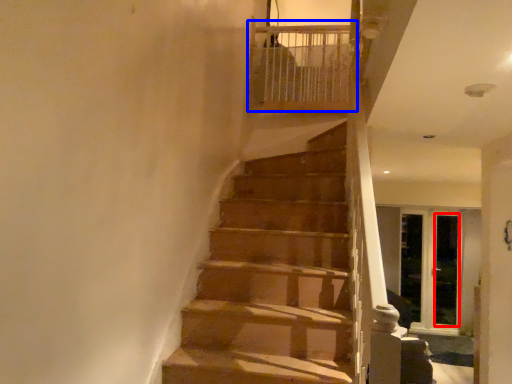
Question: Among these objects, which one is farthest to the camera, screen door (highlighted by a red box) or balustrade (highlighted by a blue box)?

Choices:
 (A) screen door
 (B) balustrade

Answer: (A)